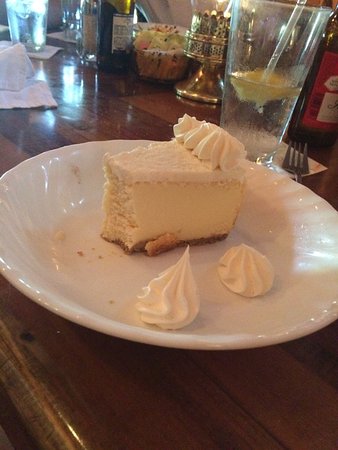
Image resolution: width=338 pixels, height=450 pixels. I want to click on napkin, so click(x=34, y=98).